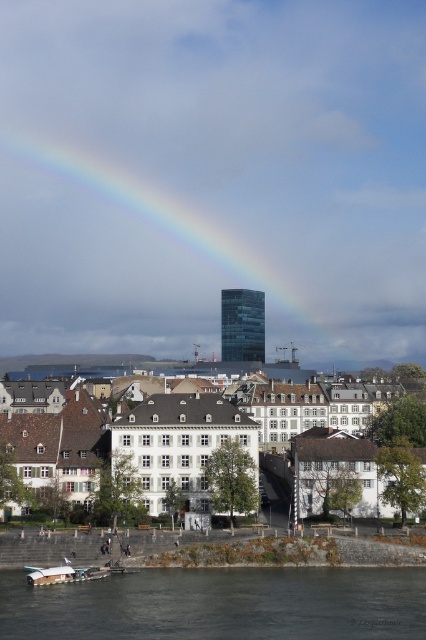
Does point (28, 316) come behind point (152, 637)?

Yes, it is.

Is rainbow glass at upper center in front of clear water at lower center?

No, rainbow glass at upper center is behind clear water at lower center.

This screenshot has height=640, width=426. I want to click on rainbow glass at upper center, so click(x=169, y=244).

Locate an element on the screen. This screenshot has height=640, width=426. rainbow glass at upper center is located at coordinates (169, 244).

Which is above, clear water at lower center or white wooden houses at center?

Positioned higher is white wooden houses at center.

In the scene shown: Which is more to the right, clear water at lower center or white wooden houses at center?

clear water at lower center

Does point (8, 588) lie in front of point (284, 404)?

That is True.

Image resolution: width=426 pixels, height=640 pixels. Identify the location of clear water at lower center. [221, 604].

Who is higher up, white wooden houses at center or white plastic boat at lower left?

white wooden houses at center

Is point (204, 465) farther from viewer compared to point (63, 580)?

Yes, point (204, 465) is behind point (63, 580).

Between point (276, 381) and point (54, 580), which one is positioned behind?

Positioned behind is point (276, 381).

Find the location of `white wooden houses at center`. white wooden houses at center is located at coordinates (224, 420).